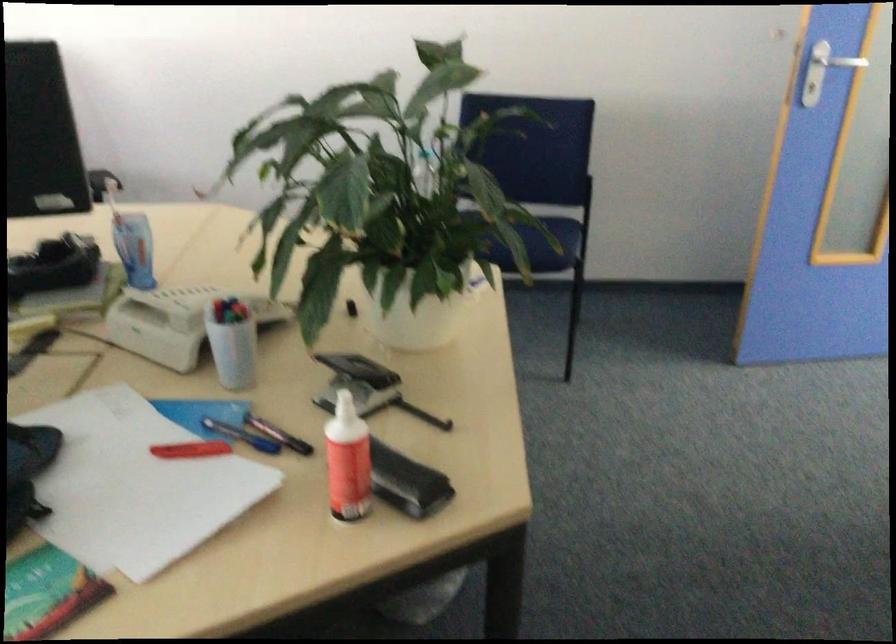
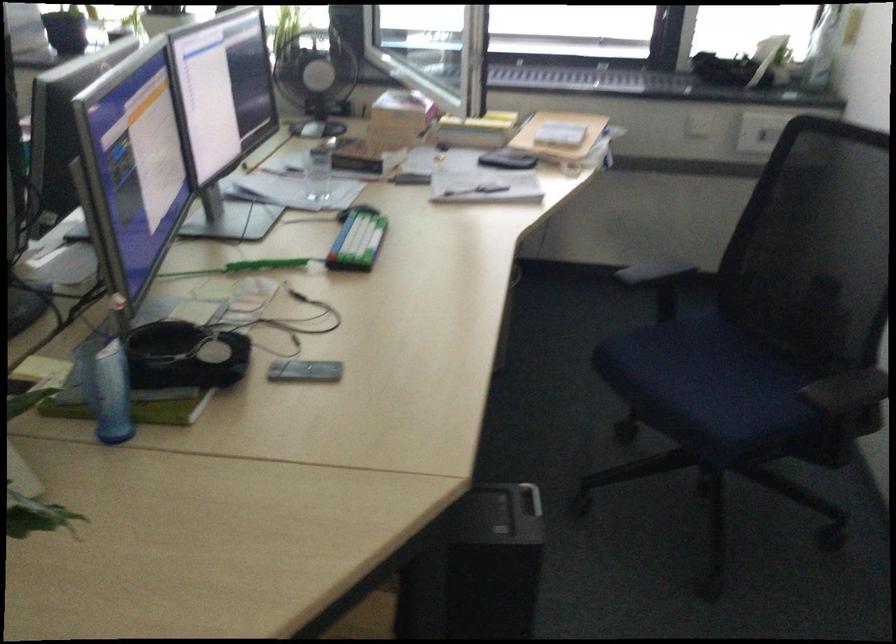
In the second image, find the point that corresponds to (x=85, y=261) in the first image.

(110, 393)